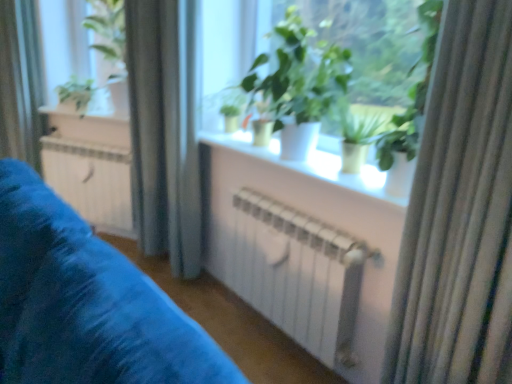
What do you see at coordinates (298, 85) in the screenshot? I see `green matte plant at center, marked as the 3th houseplant in a back-to-front arrangement` at bounding box center [298, 85].

Identify the location of white matte window sill at center, arranged as the first window sill when viewed from the right. (310, 165).

What is the approximate height of white metallic radiator at center?

23.51 inches.

At what (x,y) coordinates should I click in order to perform the action: click on white metallic radiator at center. Please return your answer as a coordinate pair (x, y). Looking at the image, I should click on (91, 181).

Where is `white matte radiator at center`? The image size is (512, 384). white matte radiator at center is located at coordinates (86, 303).

This screenshot has width=512, height=384. I want to click on blue fabric curtain at left, acting as the third curtain starting from the right, so click(20, 83).

Where is `white glossy window sill at upper center, marked as the 2th window sill in a front-to-back arrangement`? The height and width of the screenshot is (384, 512). white glossy window sill at upper center, marked as the 2th window sill in a front-to-back arrangement is located at coordinates click(x=108, y=113).

Is white glossy window sill at upper center, positioned as the 1th window sill in top-to-bottom order, aimed at satin fabric curtain at left, which is the 2th curtain from right to left?

No, white glossy window sill at upper center, positioned as the 1th window sill in top-to-bottom order, is not aimed at satin fabric curtain at left, which is the 2th curtain from right to left.

How much distance is there between white glossy window sill at upper center, which is the 1th window sill from back to front, and satin fabric curtain at left, marked as the second curtain in a back-to-front arrangement?

28.22 inches.

In the image, is white glossy window sill at upper center, marked as the 2th window sill in a front-to-back arrangement, on the left side or the right side of satin fabric curtain at left, arranged as the second curtain when viewed from the left?

In the image, white glossy window sill at upper center, marked as the 2th window sill in a front-to-back arrangement, appears on the left side of satin fabric curtain at left, arranged as the second curtain when viewed from the left.

How different are the orientations of white matte window sill at center, which is the second window sill in top-to-bottom order, and satin fabric curtain at left, which is the 2th curtain from right to left, in degrees?

A: There is a 28.4-degree angle between the facing directions of white matte window sill at center, which is the second window sill in top-to-bottom order, and satin fabric curtain at left, which is the 2th curtain from right to left.

Is satin fabric curtain at left, which is the 2th curtain from right to left, located within white matte window sill at center, the 1th window sill in the bottom-to-top sequence?

That's incorrect, satin fabric curtain at left, which is the 2th curtain from right to left, is not inside white matte window sill at center, the 1th window sill in the bottom-to-top sequence.

From the image's perspective, is white matte window sill at center, marked as the 2th window sill in a left-to-right arrangement, positioned above or below satin fabric curtain at left, arranged as the second curtain when viewed from the left?

white matte window sill at center, marked as the 2th window sill in a left-to-right arrangement, is situated lower than satin fabric curtain at left, arranged as the second curtain when viewed from the left, in the image.

Is white matte window sill at center, marked as the 2th window sill in a left-to-right arrangement, positioned with its back to satin fabric curtain at left, the second curtain when ordered from front to back?

Result: That's not correct — white matte window sill at center, marked as the 2th window sill in a left-to-right arrangement, is not looking away from satin fabric curtain at left, the second curtain when ordered from front to back.

The width and height of the screenshot is (512, 384). Identify the location of the 1st curtain to the right when counting from the blue fabric curtain at left, which is counted as the first curtain, starting from the back. (165, 130).

Between blue fabric curtain at left, which is counted as the 3th curtain, starting from the front, and satin fabric curtain at left, marked as the second curtain in a back-to-front arrangement, which one has larger width?

With larger width is satin fabric curtain at left, marked as the second curtain in a back-to-front arrangement.

What's the angular difference between blue fabric curtain at left, which is counted as the 3th curtain, starting from the front, and satin fabric curtain at left, the second curtain when ordered from front to back,'s facing directions?

The angle between the facing direction of blue fabric curtain at left, which is counted as the 3th curtain, starting from the front, and the facing direction of satin fabric curtain at left, the second curtain when ordered from front to back, is 2.78 degrees.

Considering the relative sizes of green matte plant at upper left, which ranks as the first houseplant in back-to-front order, and white matte window sill at center, marked as the 2th window sill in a left-to-right arrangement, in the image provided, is green matte plant at upper left, which ranks as the first houseplant in back-to-front order, taller than white matte window sill at center, marked as the 2th window sill in a left-to-right arrangement,?

Correct, green matte plant at upper left, which ranks as the first houseplant in back-to-front order, is much taller as white matte window sill at center, marked as the 2th window sill in a left-to-right arrangement.

Are green matte plant at upper left, which ranks as the first houseplant in back-to-front order, and white matte window sill at center, marked as the 2th window sill in a left-to-right arrangement, located far from each other?

Yes, green matte plant at upper left, which ranks as the first houseplant in back-to-front order, and white matte window sill at center, marked as the 2th window sill in a left-to-right arrangement, are quite far apart.

Based on the photo, from a real-world perspective, is green matte plant at upper left, marked as the 3th houseplant in a front-to-back arrangement, physically located above or below white matte window sill at center, which is the second window sill in top-to-bottom order?

In terms of real-world spatial position, green matte plant at upper left, marked as the 3th houseplant in a front-to-back arrangement, is above white matte window sill at center, which is the second window sill in top-to-bottom order.

Is green matte plant at upper left, which ranks as the first houseplant in back-to-front order, bigger or smaller than white matte window sill at center, marked as the 2th window sill in a left-to-right arrangement?

Clearly, green matte plant at upper left, which ranks as the first houseplant in back-to-front order, is larger in size than white matte window sill at center, marked as the 2th window sill in a left-to-right arrangement.

Could you measure the distance between green matte plant at center, marked as the 2th houseplant in a back-to-front arrangement, and white matte window sill at center, marked as the second window sill in a back-to-front arrangement?

A distance of 8.79 inches exists between green matte plant at center, marked as the 2th houseplant in a back-to-front arrangement, and white matte window sill at center, marked as the second window sill in a back-to-front arrangement.

Does green matte plant at center, which is the 2th houseplant from front to back, come in front of white matte window sill at center, marked as the 2th window sill in a left-to-right arrangement?

No, the depth of green matte plant at center, which is the 2th houseplant from front to back, is greater than that of white matte window sill at center, marked as the 2th window sill in a left-to-right arrangement.

Considering the relative sizes of green matte plant at center, marked as the 2th houseplant in a back-to-front arrangement, and white matte window sill at center, which is the second window sill in top-to-bottom order, in the image provided, is green matte plant at center, marked as the 2th houseplant in a back-to-front arrangement, bigger than white matte window sill at center, which is the second window sill in top-to-bottom order,?

Incorrect, green matte plant at center, marked as the 2th houseplant in a back-to-front arrangement, is not larger than white matte window sill at center, which is the second window sill in top-to-bottom order.

Looking at the image, does white metallic radiator at center seem bigger or smaller compared to white matte window sill at center, the 1th window sill in the bottom-to-top sequence?

white metallic radiator at center is bigger than white matte window sill at center, the 1th window sill in the bottom-to-top sequence.

Locate an element on the screen. The image size is (512, 384). the 2nd window sill counting from the right of the white metallic radiator at center is located at coordinates (310, 165).

Measure the distance between white metallic radiator at center and white matte window sill at center, the 1th window sill in the bottom-to-top sequence.

A distance of 1.13 meters exists between white metallic radiator at center and white matte window sill at center, the 1th window sill in the bottom-to-top sequence.

From the image's perspective, between white metallic radiator at center and white matte window sill at center, marked as the second window sill in a back-to-front arrangement, who is located below?

white metallic radiator at center is shown below in the image.

Which is more to the right, white matte radiator at center or green matte plant at center, which appears as the second houseplant when viewed from the left?

green matte plant at center, which appears as the second houseplant when viewed from the left, is more to the right.

Can you tell me how much white matte radiator at center and green matte plant at center, the first houseplant viewed from the front, differ in facing direction?

white matte radiator at center and green matte plant at center, the first houseplant viewed from the front, are facing 0.318 degrees away from each other.

Between point (89, 288) and point (340, 75), which one is positioned in front?

Point (89, 288)

From the image's perspective, is white matte radiator at center positioned above or below green matte plant at center, the first houseplant viewed from the front?

Based on their image positions, white matte radiator at center is located beneath green matte plant at center, the first houseplant viewed from the front.

In order to click on the 2nd curtain in front of the white glossy window sill at upper center, acting as the second window sill starting from the right, counting from the anchor's position in this screenshot , I will do `click(165, 130)`.

Which curtain is the 1st one when counting from the back of the white matte window sill at center, marked as the 2th window sill in a left-to-right arrangement? Please provide its 2D coordinates.

[(165, 130)]

Based on their spatial positions, is green matte plant at center, marked as the 3th houseplant in a back-to-front arrangement, or white glossy window sill at upper center, acting as the second window sill starting from the bottom, further from green matte plant at center, which is the 2th houseplant from front to back?

white glossy window sill at upper center, acting as the second window sill starting from the bottom, is further to green matte plant at center, which is the 2th houseplant from front to back.

Estimate the real-world distances between objects in this image. Which object is closer to silky beige curtain at right, which is counted as the first curtain, starting from the right, green matte plant at upper left, the third houseplant viewed from the right, or green matte plant at center, which appears as the second houseplant when viewed from the left?

green matte plant at center, which appears as the second houseplant when viewed from the left.

From the image, which object appears to be nearer to green matte plant at upper left, marked as the 3th houseplant in a front-to-back arrangement, green matte plant at center, which is the 2th houseplant from front to back, or silky beige curtain at right, arranged as the 3th curtain when viewed from the left?

green matte plant at center, which is the 2th houseplant from front to back, is positioned closer to the anchor green matte plant at upper left, marked as the 3th houseplant in a front-to-back arrangement.

Looking at the image, which one is located closer to white glossy window sill at upper center, acting as the second window sill starting from the bottom, white matte radiator at center or white matte window sill at center, which is the second window sill in top-to-bottom order?

white matte window sill at center, which is the second window sill in top-to-bottom order, lies closer to white glossy window sill at upper center, acting as the second window sill starting from the bottom, than the other object.

When comparing their distances from white metallic radiator at center, does white glossy window sill at upper center, marked as the 2th window sill in a front-to-back arrangement, or green matte plant at center, which is the 2th houseplant from front to back, seem further?

white glossy window sill at upper center, marked as the 2th window sill in a front-to-back arrangement, is positioned further to the anchor white metallic radiator at center.

Looking at the image, which one is located closer to white glossy window sill at upper center, acting as the second window sill starting from the bottom, satin fabric curtain at left, marked as the second curtain in a back-to-front arrangement, or green matte plant at center, the first houseplant viewed from the front?

The object closer to white glossy window sill at upper center, acting as the second window sill starting from the bottom, is satin fabric curtain at left, marked as the second curtain in a back-to-front arrangement.

From the image, which object appears to be farther from green matte plant at center, which is the 1th houseplant in right-to-left order, white glossy window sill at upper center, acting as the second window sill starting from the right, or white metallic radiator at center?

Based on the image, white glossy window sill at upper center, acting as the second window sill starting from the right, appears to be further to green matte plant at center, which is the 1th houseplant in right-to-left order.

From the image, which object appears to be farther from white metallic radiator at center, green matte plant at upper left, marked as the 3th houseplant in a front-to-back arrangement, or blue fabric curtain at left, acting as the third curtain starting from the right?

Among the two, green matte plant at upper left, marked as the 3th houseplant in a front-to-back arrangement, is located further to white metallic radiator at center.

Identify the location of curtain between green matte plant at upper left, arranged as the first houseplant when viewed from the left, and white matte window sill at center, marked as the 2th window sill in a left-to-right arrangement, in the horizontal direction. The width and height of the screenshot is (512, 384). (165, 130).

Where is `houseplant between blue fabric curtain at left, which is counted as the 3th curtain, starting from the front, and white matte window sill at center, marked as the 2th window sill in a left-to-right arrangement`? The width and height of the screenshot is (512, 384). houseplant between blue fabric curtain at left, which is counted as the 3th curtain, starting from the front, and white matte window sill at center, marked as the 2th window sill in a left-to-right arrangement is located at coordinates (76, 94).

Locate an element on the screen. The height and width of the screenshot is (384, 512). houseplant situated between blue fabric curtain at left, acting as the 1th curtain starting from the left, and white metallic radiator at center from left to right is located at coordinates (76, 94).

You are a GUI agent. You are given a task and a screenshot of the screen. Output one action in this format:
    pyautogui.click(x=<x>, y=<y>)
    Task: Click on the window sill positioned between white matte radiator at center and white metallic radiator at center from near to far
    This screenshot has width=512, height=384.
    Given the screenshot: What is the action you would take?
    pyautogui.click(x=310, y=165)